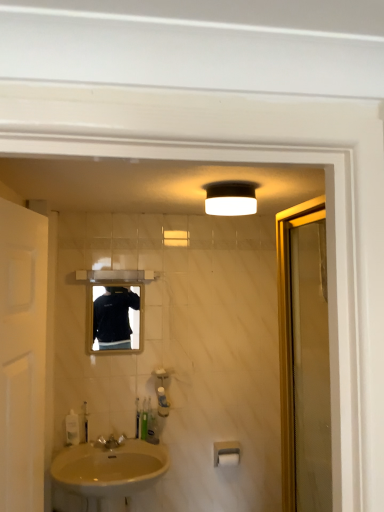
Question: Does translucent plastic soap dispenser at lower center, which ranks as the third toiletry in right-to-left order, have a larger size compared to green plastic toothbrush at lower center, which is the fourth toiletry from right to left?

Choices:
 (A) yes
 (B) no

Answer: (A)

Question: Is translucent plastic soap dispenser at lower center, the 3th toiletry viewed from the left, shorter than green plastic toothbrush at lower center, which ranks as the second toiletry in left-to-right order?

Choices:
 (A) no
 (B) yes

Answer: (A)

Question: From a real-world perspective, is translucent plastic soap dispenser at lower center, which ranks as the third toiletry in right-to-left order, below green plastic toothbrush at lower center, which is the fourth toiletry from right to left?

Choices:
 (A) no
 (B) yes

Answer: (A)

Question: Could you tell me if translucent plastic soap dispenser at lower center, the 3th toiletry viewed from the left, is facing green plastic toothbrush at lower center, which ranks as the second toiletry in left-to-right order?

Choices:
 (A) yes
 (B) no

Answer: (B)

Question: Is translucent plastic soap dispenser at lower center, which ranks as the third toiletry in right-to-left order, thinner than green plastic toothbrush at lower center, which ranks as the second toiletry in left-to-right order?

Choices:
 (A) no
 (B) yes

Answer: (A)

Question: Is the position of translucent plastic soap dispenser at lower center, which ranks as the third toiletry in right-to-left order, less distant than that of green plastic toothbrush at lower center, which ranks as the second toiletry in left-to-right order?

Choices:
 (A) no
 (B) yes

Answer: (A)

Question: Is beige porcelain sink at lower left at the back of white matte toilet paper at lower center?

Choices:
 (A) yes
 (B) no

Answer: (B)

Question: Does white matte toilet paper at lower center have a greater height compared to beige porcelain sink at lower left?

Choices:
 (A) no
 (B) yes

Answer: (A)

Question: Is white matte toilet paper at lower center further to camera compared to beige porcelain sink at lower left?

Choices:
 (A) yes
 (B) no

Answer: (A)

Question: Is the position of white matte toilet paper at lower center less distant than that of beige porcelain sink at lower left?

Choices:
 (A) no
 (B) yes

Answer: (A)

Question: Is white matte toilet paper at lower center smaller than beige porcelain sink at lower left?

Choices:
 (A) yes
 (B) no

Answer: (A)

Question: Is white matte toilet paper at lower center thinner than beige porcelain sink at lower left?

Choices:
 (A) no
 (B) yes

Answer: (B)

Question: Can you confirm if clear plastic bottle at lower left, which ranks as the fifth toiletry in right-to-left order, is positioned to the left of white matte door at left?

Choices:
 (A) yes
 (B) no

Answer: (A)